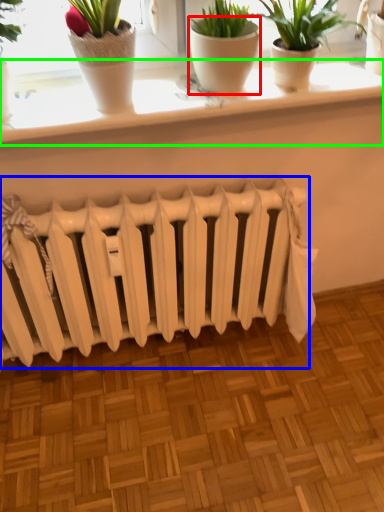
Question: Based on their relative distances, which object is nearer to flowerpot (highlighted by a red box)? Choose from radiator (highlighted by a blue box) and window sill (highlighted by a green box).

Choices:
 (A) radiator
 (B) window sill

Answer: (B)